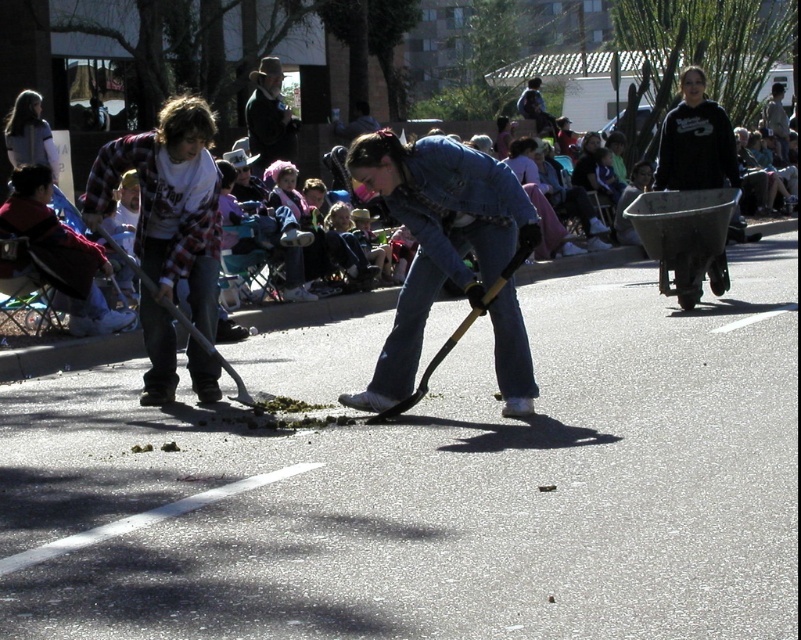
Which is below, jeans at center or metallic gray wheelbarrow at right?

Positioned lower is jeans at center.

Between point (421, 266) and point (719, 280), which one is positioned behind?

The point (719, 280) is more distant.

Between point (479, 248) and point (670, 195), which one is positioned in front?

Positioned in front is point (479, 248).

Find the location of a particular element. This screenshot has height=640, width=801. jeans at center is located at coordinates (407, 330).

Is flannel plaid shirt at left wider than metallic gray wheelbarrow at right?

In fact, flannel plaid shirt at left might be narrower than metallic gray wheelbarrow at right.

Which is behind, point (99, 180) or point (729, 196)?

Point (729, 196)

Image resolution: width=801 pixels, height=640 pixels. Describe the element at coordinates (167, 225) in the screenshot. I see `flannel plaid shirt at left` at that location.

Identify the location of flannel plaid shirt at left. Image resolution: width=801 pixels, height=640 pixels. (167, 225).

Is point (486, 280) positioned before point (191, 275)?

Yes, point (486, 280) is in front of point (191, 275).

Is jeans at center taller than denim jeans at left?

Indeed, jeans at center has a greater height compared to denim jeans at left.

Measure the distance between point (498, 333) and camera.

Point (498, 333) is 8.04 meters away from camera.

At what (x,y) coordinates should I click in order to perform the action: click on jeans at center. Please return your answer as a coordinate pair (x, y). This screenshot has width=801, height=640. Looking at the image, I should click on (407, 330).